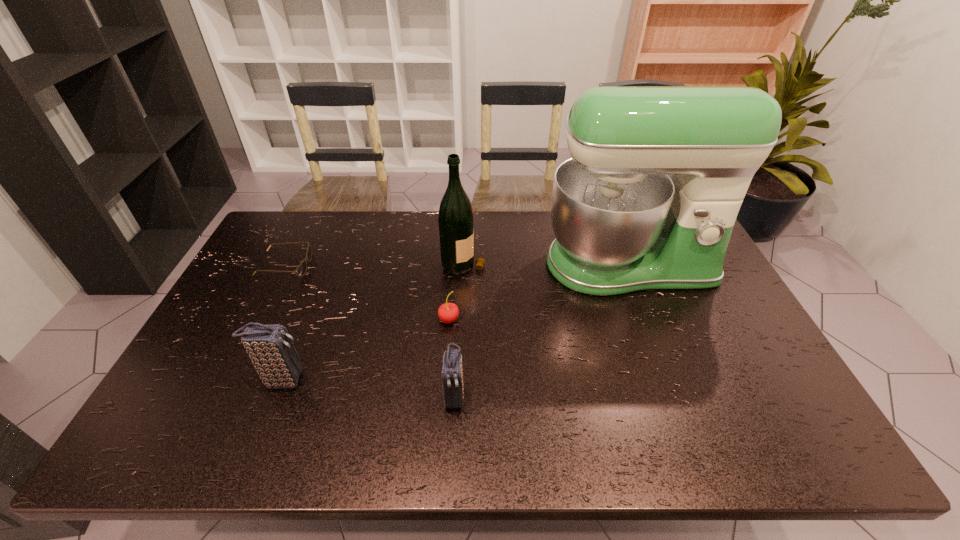
At what (x,y) coordinates should I click in order to perform the action: click on the taller clutch bag. Please return your answer as a coordinate pair (x, y). The image size is (960, 540). Looking at the image, I should click on (270, 347).

This screenshot has height=540, width=960. I want to click on the left clutch bag, so click(x=270, y=347).

Identify the location of the third shortest object. (452, 376).

The height and width of the screenshot is (540, 960). Find the location of `the shorter clutch bag`. the shorter clutch bag is located at coordinates tap(452, 376).

At what (x,y) coordinates should I click in order to perform the action: click on the shortest object. Please return your answer as a coordinate pair (x, y). Image resolution: width=960 pixels, height=540 pixels. Looking at the image, I should click on (301, 269).

Identify the location of the second tallest object. (456, 230).

At what (x,y) coordinates should I click in order to perform the action: click on the tallest object. Please return your answer as a coordinate pair (x, y). The height and width of the screenshot is (540, 960). Looking at the image, I should click on (621, 224).

In order to click on the rightmost object in this screenshot , I will do `click(621, 224)`.

Where is `the fourth farthest object`? The height and width of the screenshot is (540, 960). the fourth farthest object is located at coordinates (448, 313).

The image size is (960, 540). I want to click on cherry, so click(x=448, y=313).